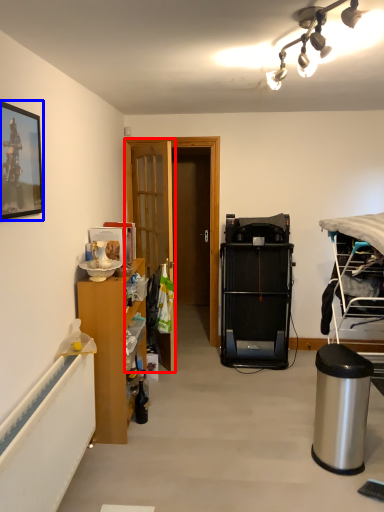
Question: Which point is closer to the camera, door (highlighted by a red box) or picture frame (highlighted by a blue box)?

Choices:
 (A) door
 (B) picture frame

Answer: (B)